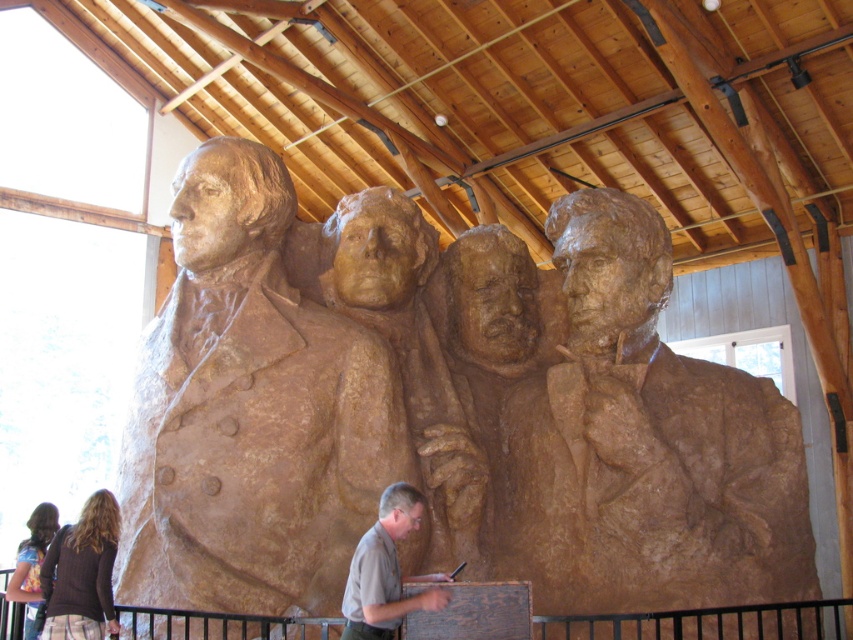
You are an art curator assessing the spatial arrangement of the sculptures in the room. Given that the brown textured bust at right is much taller than the brown textured sculpture at center, which object would you need to adjust if you want both to appear balanced in height from the viewer perspective?

Since the brown textured bust at right is much taller than the brown textured sculpture at center, you would need to lower the brown textured bust at right or raise the brown textured sculpture at center to achieve a balanced height between both objects.

Looking at this image, you are standing in the room with the Mount Rushmore sculpture and want to touch the closest point to you on the sculpture. Which point should you aim for, point [604,202] or point [436,435]?

Point [436,435] is closer to you than point [604,202], so you should aim for point [436,435].

You are an art curator planning to display the brown textured bust at right and the brown textured uniform at center in a new exhibition. Given their sizes, which object would require a wider display base to accommodate its dimensions?

The brown textured bust at right requires a wider display base because its width surpasses that of the brown textured uniform at center.